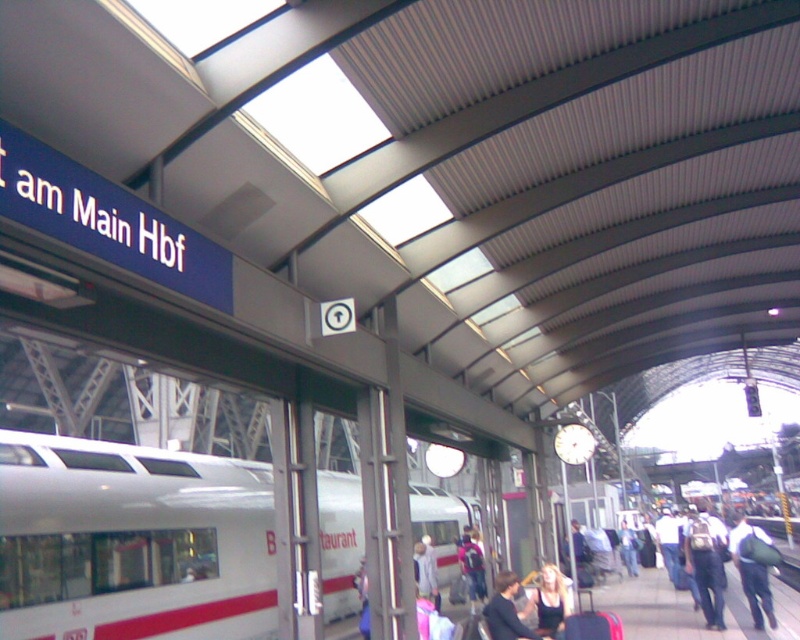
Question: Is white glossy train at left behind dark brown leather jacket at lower center?

Choices:
 (A) no
 (B) yes

Answer: (B)

Question: Observing the image, what is the correct spatial positioning of green fabric backpack at lower right in reference to dark brown leather jacket at lower center?

Choices:
 (A) left
 (B) right

Answer: (B)

Question: Which point is closer to the camera taking this photo?

Choices:
 (A) (541, 636)
 (B) (24, 634)
 (C) (540, 576)
 (D) (626, 541)

Answer: (A)

Question: Which point appears farthest from the camera in this image?

Choices:
 (A) (266, 538)
 (B) (560, 582)
 (C) (490, 611)

Answer: (A)

Question: Where is white glossy train at left located in relation to light brown leather jacket at lower right in the image?

Choices:
 (A) right
 (B) left

Answer: (B)

Question: Which object is positioned closest to the white glossy train at left?

Choices:
 (A) dark brown leather jacket at lower center
 (B) light brown leather jacket at lower right
 (C) green fabric backpack at lower right

Answer: (A)